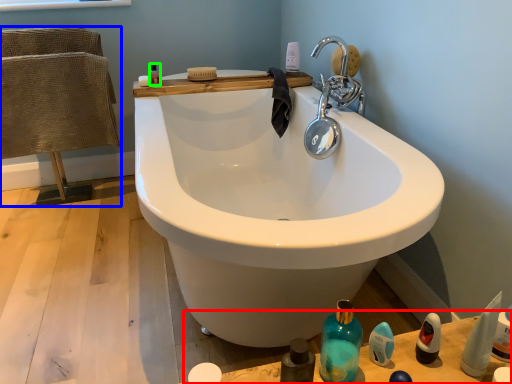
Question: Based on their relative distances, which object is farther from counter top (highlighted by a red box)? Choose from chair (highlighted by a blue box) and mouthwash (highlighted by a green box).

Choices:
 (A) chair
 (B) mouthwash

Answer: (A)